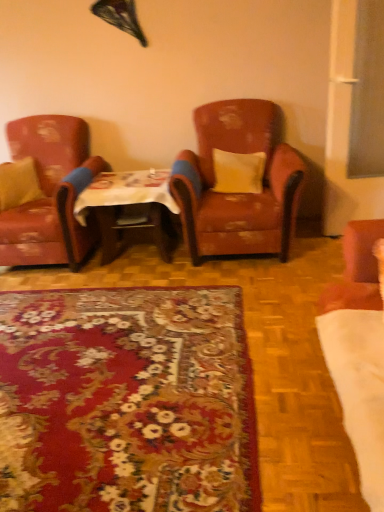
Question: Does wooden table at center come behind yellow fabric pillow at center, which is counted as the 2th pillow, starting from the left?

Choices:
 (A) no
 (B) yes

Answer: (A)

Question: From a real-world perspective, is wooden table at center below yellow fabric pillow at center, which is counted as the 2th pillow, starting from the left?

Choices:
 (A) no
 (B) yes

Answer: (B)

Question: From the image's perspective, is wooden table at center on top of yellow fabric pillow at center, which is counted as the 2th pillow, starting from the left?

Choices:
 (A) no
 (B) yes

Answer: (A)

Question: Is wooden table at center smaller than yellow fabric pillow at center, which is the first pillow in right-to-left order?

Choices:
 (A) yes
 (B) no

Answer: (B)

Question: Is wooden table at center looking in the opposite direction of yellow fabric pillow at center, which is counted as the 2th pillow, starting from the left?

Choices:
 (A) yes
 (B) no

Answer: (B)

Question: Would you say floral carpet at center is to the left or to the right of wooden table at center in the picture?

Choices:
 (A) right
 (B) left

Answer: (B)

Question: Is point (148, 351) positioned closer to the camera than point (163, 196)?

Choices:
 (A) closer
 (B) farther

Answer: (A)

Question: In terms of height, does floral carpet at center look taller or shorter compared to wooden table at center?

Choices:
 (A) short
 (B) tall

Answer: (A)

Question: Is floral carpet at center in front of or behind wooden table at center in the image?

Choices:
 (A) behind
 (B) front

Answer: (B)

Question: Based on their sizes in the image, would you say leather-like brown armchair at center, which appears as the 1th chair when viewed from the right, is bigger or smaller than matte yellow pillow at left, positioned as the first pillow in left-to-right order?

Choices:
 (A) big
 (B) small

Answer: (A)

Question: Is leather-like brown armchair at center, which appears as the 1th chair when viewed from the right, taller or shorter than matte yellow pillow at left, the 2th pillow in the right-to-left sequence?

Choices:
 (A) short
 (B) tall

Answer: (B)

Question: From a real-world perspective, is leather-like brown armchair at center, which appears as the 1th chair when viewed from the right, positioned above or below matte yellow pillow at left, positioned as the first pillow in left-to-right order?

Choices:
 (A) above
 (B) below

Answer: (B)

Question: From the image's perspective, is leather-like brown armchair at center, the second chair positioned from the left, positioned above or below matte yellow pillow at left, the 2th pillow in the right-to-left sequence?

Choices:
 (A) below
 (B) above

Answer: (B)

Question: Is wooden table at center taller or shorter than yellow fabric pillow at center, which is the first pillow in right-to-left order?

Choices:
 (A) tall
 (B) short

Answer: (A)

Question: From the image's perspective, is wooden table at center above or below yellow fabric pillow at center, which is counted as the 2th pillow, starting from the left?

Choices:
 (A) above
 (B) below

Answer: (B)